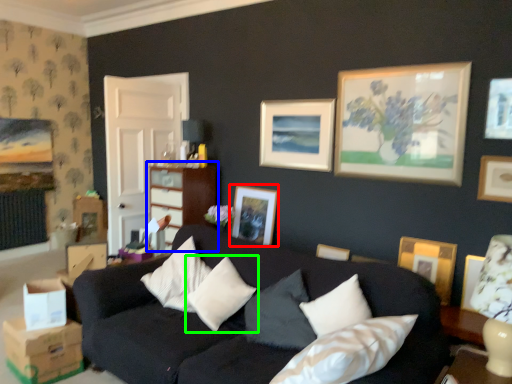
Question: Which is farther away from picture frame (highlighted by a red box)? dresser (highlighted by a blue box) or pillow (highlighted by a green box)?

Choices:
 (A) dresser
 (B) pillow

Answer: (B)